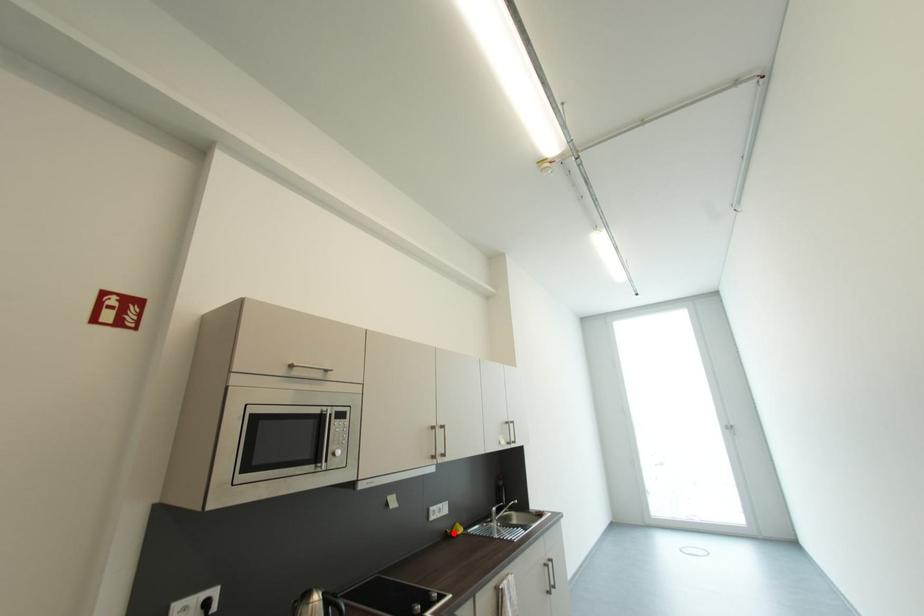
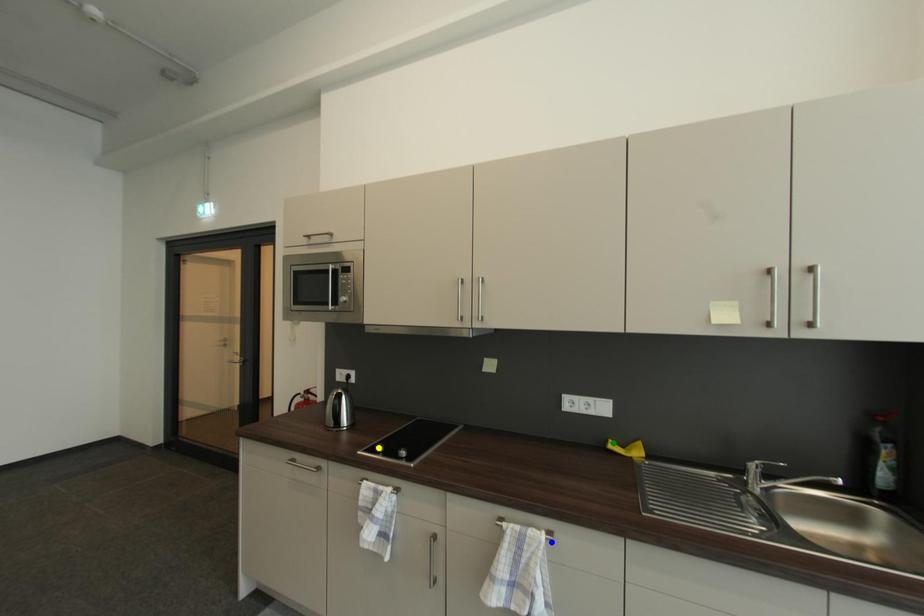
Question: I am providing you with two images of the same scene from different viewpoints. A red point is marked on the first image. You are given multiple points on the second image. Which spot in image 2 lines up with the point in image 1?

Choices:
 (A) blue point
 (B) green point
 (C) yellow point

Answer: (B)